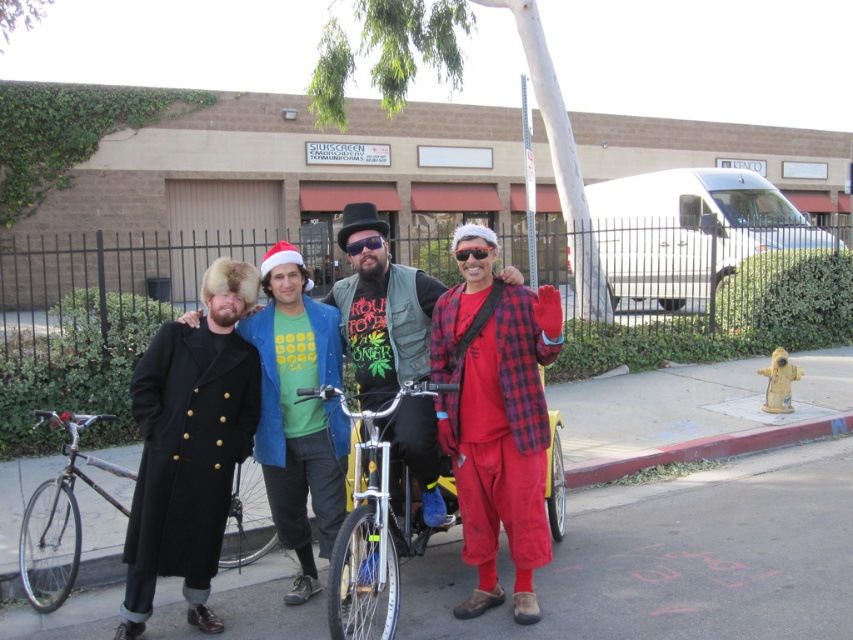
Is black wool coat at center positioned before silver metallic bicycle at center?

That is False.

Is black wool coat at center to the right of silver metallic bicycle at center from the viewer's perspective?

No, black wool coat at center is not to the right of silver metallic bicycle at center.

Is point (231, 464) more distant than point (392, 584)?

Yes, point (231, 464) is behind point (392, 584).

Locate an element on the screen. The height and width of the screenshot is (640, 853). black wool coat at center is located at coordinates (190, 445).

Which is more to the right, black wool coat at left or silver metallic bicycle at center?

silver metallic bicycle at center

Can you confirm if black wool coat at left is thinner than silver metallic bicycle at center?

Correct, black wool coat at left's width is less than silver metallic bicycle at center's.

What do you see at coordinates (299, 412) in the screenshot? The height and width of the screenshot is (640, 853). I see `black wool coat at left` at bounding box center [299, 412].

This screenshot has width=853, height=640. Find the location of `black wool coat at left`. black wool coat at left is located at coordinates (299, 412).

Does point (358, 621) come closer to viewer compared to point (57, 605)?

Yes, it is.

I want to click on silver metallic bicycle at center, so click(370, 524).

Image resolution: width=853 pixels, height=640 pixels. What do you see at coordinates (370, 524) in the screenshot?
I see `silver metallic bicycle at center` at bounding box center [370, 524].

The image size is (853, 640). I want to click on silver metallic bicycle at center, so click(x=370, y=524).